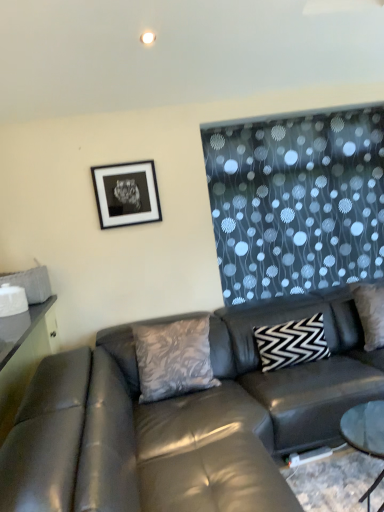
Measure the distance between matte black swivel chair at left and camera.

matte black swivel chair at left and camera are 3.84 feet apart.

The width and height of the screenshot is (384, 512). Identify the location of black and white zigzag pillow at center, acting as the 2th pillow starting from the left. (292, 343).

Locate an element on the screen. black matte picture frame at upper left is located at coordinates (126, 194).

The width and height of the screenshot is (384, 512). Describe the element at coordinates (185, 419) in the screenshot. I see `leather couch at center` at that location.

In order to click on matte black swivel chair at left in this screenshot , I will do `click(46, 437)`.

Considering their positions, is silky gray pillow at center, positioned as the 2th pillow in right-to-left order, located in front of or behind black and white zigzag pillow at center, acting as the 2th pillow starting from the left?

silky gray pillow at center, positioned as the 2th pillow in right-to-left order, is in front of black and white zigzag pillow at center, acting as the 2th pillow starting from the left.

Identify the location of pillow that appears in front of the black and white zigzag pillow at center, acting as the 2th pillow starting from the left. The height and width of the screenshot is (512, 384). (173, 358).

Is silky gray pillow at center, positioned as the 2th pillow in right-to-left order, aimed at black and white zigzag pillow at center, acting as the 2th pillow starting from the left?

No, silky gray pillow at center, positioned as the 2th pillow in right-to-left order, is not aimed at black and white zigzag pillow at center, acting as the 2th pillow starting from the left.

How far apart are silky gray pillow at center, which ranks as the first pillow in left-to-right order, and black and white zigzag pillow at center, acting as the 2th pillow starting from the left?

silky gray pillow at center, which ranks as the first pillow in left-to-right order, is 22.26 inches from black and white zigzag pillow at center, acting as the 2th pillow starting from the left.

Is black matte picture frame at upper left in front of or behind black and white zigzag pillow at center, which is the 1th pillow from right to left, in the image?

black matte picture frame at upper left is positioned farther from the viewer than black and white zigzag pillow at center, which is the 1th pillow from right to left.

Considering the relative sizes of black matte picture frame at upper left and black and white zigzag pillow at center, acting as the 2th pillow starting from the left, in the image provided, is black matte picture frame at upper left wider than black and white zigzag pillow at center, acting as the 2th pillow starting from the left,?

Incorrect, the width of black matte picture frame at upper left does not surpass that of black and white zigzag pillow at center, acting as the 2th pillow starting from the left.

From a real-world perspective, which object stands above the other?

From a 3D spatial view, black matte picture frame at upper left is above.

Is leather couch at center at the right side of silky gray pillow at center, which ranks as the first pillow in left-to-right order?

Correct, you'll find leather couch at center to the right of silky gray pillow at center, which ranks as the first pillow in left-to-right order.

From a real-world perspective, relative to silky gray pillow at center, which ranks as the first pillow in left-to-right order, is leather couch at center vertically above or below?

leather couch at center is below silky gray pillow at center, which ranks as the first pillow in left-to-right order.

Is leather couch at center oriented towards silky gray pillow at center, which ranks as the first pillow in left-to-right order?

No, leather couch at center is not turned towards silky gray pillow at center, which ranks as the first pillow in left-to-right order.

From the picture: Which is in front, leather couch at center or silky gray pillow at center, positioned as the 2th pillow in right-to-left order?

Positioned in front is leather couch at center.

From their relative heights in the image, would you say silky gray pillow at center, positioned as the 2th pillow in right-to-left order, is taller or shorter than matte black swivel chair at left?

In the image, silky gray pillow at center, positioned as the 2th pillow in right-to-left order, appears to be shorter than matte black swivel chair at left.

Who is smaller, silky gray pillow at center, which ranks as the first pillow in left-to-right order, or matte black swivel chair at left?

silky gray pillow at center, which ranks as the first pillow in left-to-right order, is smaller.

Can we say silky gray pillow at center, which ranks as the first pillow in left-to-right order, lies outside matte black swivel chair at left?

Yes, silky gray pillow at center, which ranks as the first pillow in left-to-right order, is not within matte black swivel chair at left.

Is matte black swivel chair at left at the back of silky gray pillow at center, which ranks as the first pillow in left-to-right order?

silky gray pillow at center, which ranks as the first pillow in left-to-right order, is not turned away from matte black swivel chair at left.

Considering the relative positions of matte black swivel chair at left and silky gray pillow at center, positioned as the 2th pillow in right-to-left order, in the image provided, is matte black swivel chair at left to the left of silky gray pillow at center, positioned as the 2th pillow in right-to-left order, from the viewer's perspective?

Yes, matte black swivel chair at left is to the left of silky gray pillow at center, positioned as the 2th pillow in right-to-left order.

Which of these two, matte black swivel chair at left or silky gray pillow at center, positioned as the 2th pillow in right-to-left order, stands shorter?

Standing shorter between the two is silky gray pillow at center, positioned as the 2th pillow in right-to-left order.

Is matte black swivel chair at left placed right next to silky gray pillow at center, positioned as the 2th pillow in right-to-left order?

matte black swivel chair at left and silky gray pillow at center, positioned as the 2th pillow in right-to-left order, are clearly separated.

In the scene shown: Which of these two, matte black swivel chair at left or silky gray pillow at center, positioned as the 2th pillow in right-to-left order, is wider?

With larger width is matte black swivel chair at left.

From a real-world perspective, which object stands above the other?

From a 3D spatial view, black and white zigzag pillow at center, acting as the 2th pillow starting from the left, is above.

Is black and white zigzag pillow at center, acting as the 2th pillow starting from the left, directly adjacent to leather couch at center?

black and white zigzag pillow at center, acting as the 2th pillow starting from the left, and leather couch at center are clearly separated.

Which is behind, point (309, 343) or point (20, 508)?

Point (309, 343)

Is leather couch at center completely or partially inside black and white zigzag pillow at center, which is the 1th pillow from right to left?

No, leather couch at center is not a part of black and white zigzag pillow at center, which is the 1th pillow from right to left.

How distant is black and white zigzag pillow at center, which is the 1th pillow from right to left, from matte black swivel chair at left?

A distance of 4.32 feet exists between black and white zigzag pillow at center, which is the 1th pillow from right to left, and matte black swivel chair at left.

Is black and white zigzag pillow at center, which is the 1th pillow from right to left, wider or thinner than matte black swivel chair at left?

In the image, black and white zigzag pillow at center, which is the 1th pillow from right to left, appears to be more narrow than matte black swivel chair at left.

In terms of size, does black and white zigzag pillow at center, which is the 1th pillow from right to left, appear bigger or smaller than matte black swivel chair at left?

Clearly, black and white zigzag pillow at center, which is the 1th pillow from right to left, is smaller in size than matte black swivel chair at left.

Is matte black swivel chair at left inside black and white zigzag pillow at center, acting as the 2th pillow starting from the left?

No, matte black swivel chair at left is not surrounded by black and white zigzag pillow at center, acting as the 2th pillow starting from the left.

The width and height of the screenshot is (384, 512). I want to click on pillow that appears on the right of silky gray pillow at center, positioned as the 2th pillow in right-to-left order, so click(292, 343).

This screenshot has height=512, width=384. In order to click on picture frame above the black and white zigzag pillow at center, acting as the 2th pillow starting from the left (from a real-world perspective) in this screenshot , I will do tap(126, 194).

From the image, which object appears to be nearer to silky gray pillow at center, which ranks as the first pillow in left-to-right order, matte black swivel chair at left or black and white zigzag pillow at center, which is the 1th pillow from right to left?

black and white zigzag pillow at center, which is the 1th pillow from right to left, lies closer to silky gray pillow at center, which ranks as the first pillow in left-to-right order, than the other object.

When comparing their distances from matte black swivel chair at left, does leather couch at center or silky gray pillow at center, which ranks as the first pillow in left-to-right order, seem further?

The object further to matte black swivel chair at left is silky gray pillow at center, which ranks as the first pillow in left-to-right order.

Considering their positions, is black matte picture frame at upper left positioned further to black and white zigzag pillow at center, acting as the 2th pillow starting from the left, than matte black swivel chair at left?

matte black swivel chair at left is positioned further to the anchor black and white zigzag pillow at center, acting as the 2th pillow starting from the left.

Which object lies nearer to the anchor point silky gray pillow at center, positioned as the 2th pillow in right-to-left order, leather couch at center or matte black swivel chair at left?

leather couch at center is closer to silky gray pillow at center, positioned as the 2th pillow in right-to-left order.

Which object lies nearer to the anchor point black matte picture frame at upper left, leather couch at center or matte black swivel chair at left?

The object closer to black matte picture frame at upper left is leather couch at center.

Based on their spatial positions, is black matte picture frame at upper left or matte black swivel chair at left further from leather couch at center?

black matte picture frame at upper left is positioned further to the anchor leather couch at center.

Estimate the real-world distances between objects in this image. Which object is closer to matte black swivel chair at left, silky gray pillow at center, positioned as the 2th pillow in right-to-left order, or black and white zigzag pillow at center, which is the 1th pillow from right to left?

silky gray pillow at center, positioned as the 2th pillow in right-to-left order, is closer to matte black swivel chair at left.

Based on their spatial positions, is leather couch at center or matte black swivel chair at left closer to black and white zigzag pillow at center, acting as the 2th pillow starting from the left?

leather couch at center lies closer to black and white zigzag pillow at center, acting as the 2th pillow starting from the left, than the other object.

Identify the location of pillow between leather couch at center and black and white zigzag pillow at center, acting as the 2th pillow starting from the left, from front to back. (173, 358).

This screenshot has width=384, height=512. Find the location of `swivel chair located between leather couch at center and black matte picture frame at upper left in the depth direction`. swivel chair located between leather couch at center and black matte picture frame at upper left in the depth direction is located at coordinates (46, 437).

This screenshot has height=512, width=384. I want to click on studio couch between matte black swivel chair at left and black and white zigzag pillow at center, which is the 1th pillow from right to left, from left to right, so click(185, 419).

This screenshot has height=512, width=384. Identify the location of pillow situated between matte black swivel chair at left and black and white zigzag pillow at center, acting as the 2th pillow starting from the left, from left to right. (173, 358).